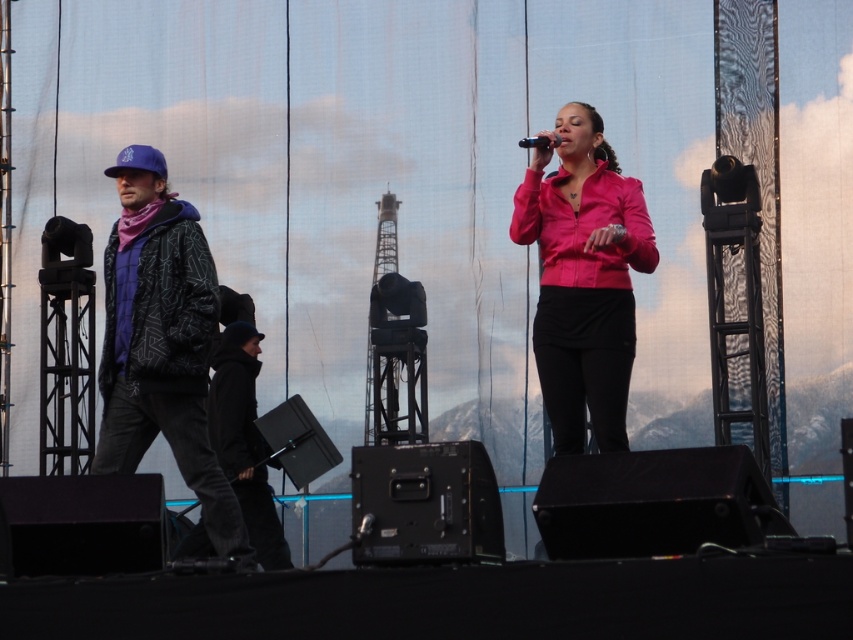
Is the position of matte black jacket at left more distant than that of pink matte jacket at center?

No, it is in front of pink matte jacket at center.

Is matte black jacket at left closer to camera compared to pink matte jacket at center?

That is True.

Is point (184, 392) positioned after point (610, 378)?

Yes, point (184, 392) is behind point (610, 378).

Locate an element on the screen. This screenshot has height=640, width=853. matte black jacket at left is located at coordinates (161, 342).

Is matte black jacket at left further to camera compared to black matte microphone at center?

No, matte black jacket at left is in front of black matte microphone at center.

Can you confirm if matte black jacket at left is positioned above black matte microphone at center?

No.

The height and width of the screenshot is (640, 853). Find the location of `matte black jacket at left`. matte black jacket at left is located at coordinates (161, 342).

Does pink matte jacket at center appear on the left side of black matte microphone at center?

In fact, pink matte jacket at center is to the right of black matte microphone at center.

Who is higher up, pink matte jacket at center or black matte microphone at center?

black matte microphone at center

The width and height of the screenshot is (853, 640). What do you see at coordinates (584, 278) in the screenshot?
I see `pink matte jacket at center` at bounding box center [584, 278].

Locate an element on the screen. The height and width of the screenshot is (640, 853). pink matte jacket at center is located at coordinates (584, 278).